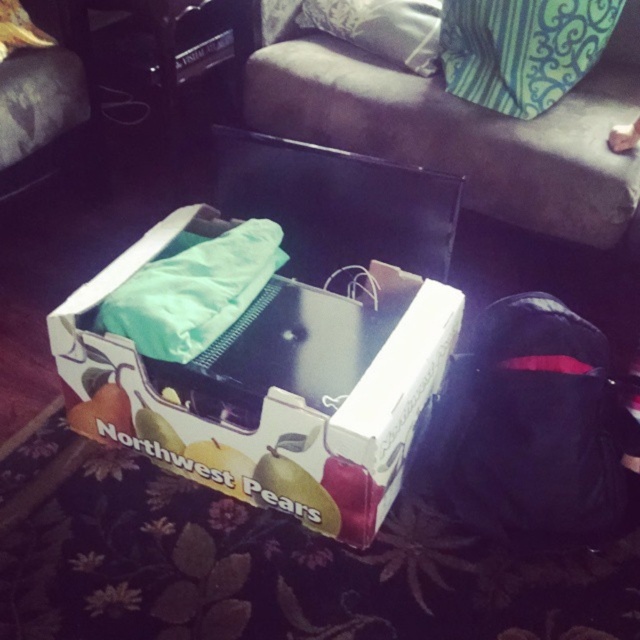
From the picture: You are trying to place a small plant on the couch in the living room. The couch is at the upper center. There is a point marked at coordinates (467, 131). Is this point on the dark fabric couch at upper center?

Yes, the point at (467, 131) indicates the dark fabric couch at upper center, so placing the plant there would be appropriate.